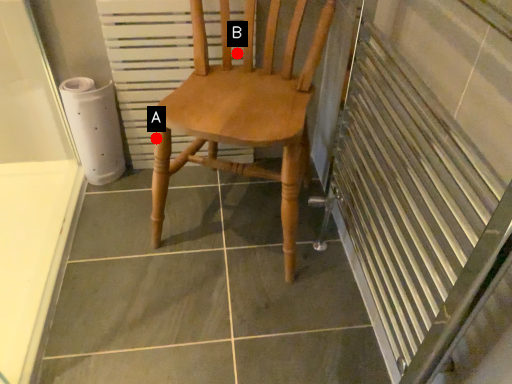
Question: Two points are circled on the image, labeled by A and B beside each circle. Which of the following is the farthest from the observer?

Choices:
 (A) A is further
 (B) B is further

Answer: (B)